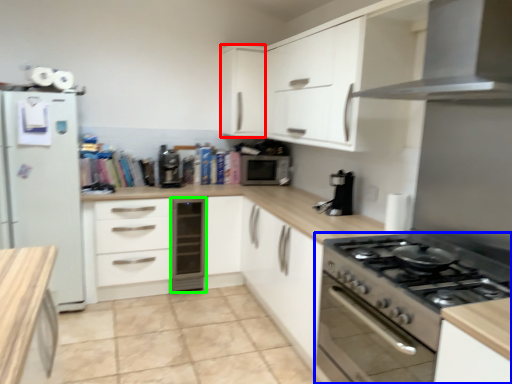
Question: Which object is positioned closest to cabinetry (highlighted by a red box)? Select from kitchen appliance (highlighted by a blue box) and dish washer (highlighted by a green box).

Choices:
 (A) kitchen appliance
 (B) dish washer

Answer: (B)